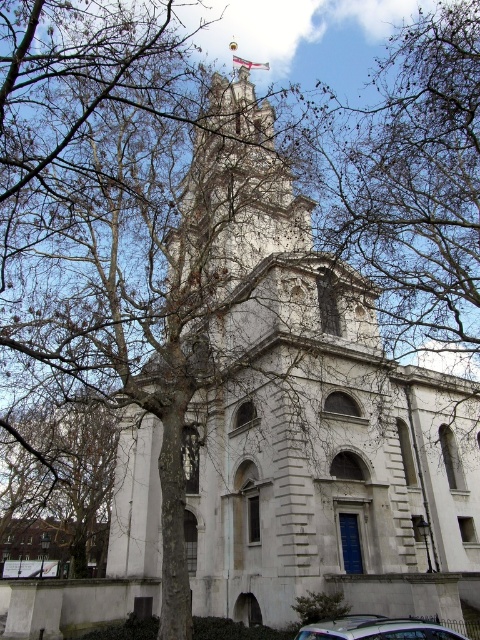
Does brown bark tree at left have a greater width compared to metallic silver car at center?

Yes, brown bark tree at left is wider than metallic silver car at center.

Does brown bark tree at left have a lesser width compared to metallic silver car at center?

No.

This screenshot has width=480, height=640. I want to click on brown bark tree at left, so click(x=59, y=484).

At what (x,y) coordinates should I click in order to perform the action: click on brown bark tree at left. Please return your answer as a coordinate pair (x, y). Image resolution: width=480 pixels, height=640 pixels. Looking at the image, I should click on (59, 484).

Can you confirm if brown bark tree at left is positioned to the left of white fabric flag at upper center?

Correct, you'll find brown bark tree at left to the left of white fabric flag at upper center.

At what (x,y) coordinates should I click in order to perform the action: click on brown bark tree at left. Please return your answer as a coordinate pair (x, y). Looking at the image, I should click on (59, 484).

How distant is white stone church at center from metallic silver car at center?

They are 32.76 meters apart.

Between white stone church at center and metallic silver car at center, which one is positioned higher?

white stone church at center

What do you see at coordinates (309, 408) in the screenshot? The height and width of the screenshot is (640, 480). I see `white stone church at center` at bounding box center [309, 408].

The width and height of the screenshot is (480, 640). I want to click on white stone church at center, so click(x=309, y=408).